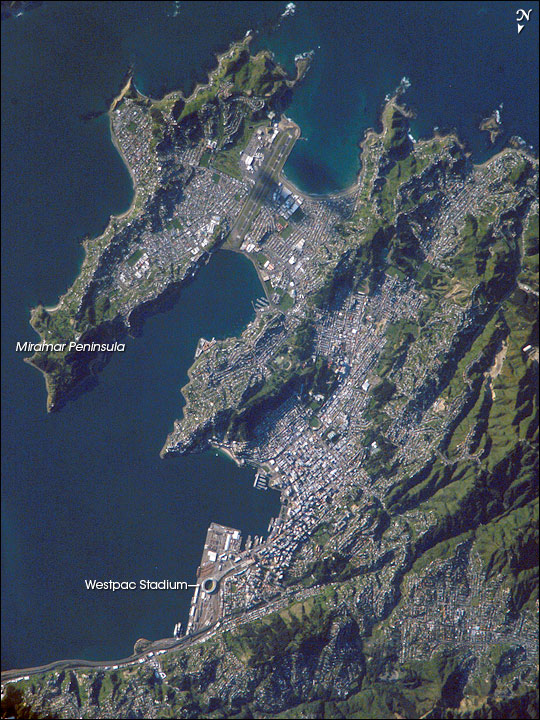
Where is `peninsula`? The width and height of the screenshot is (540, 720). peninsula is located at coordinates (66, 364).